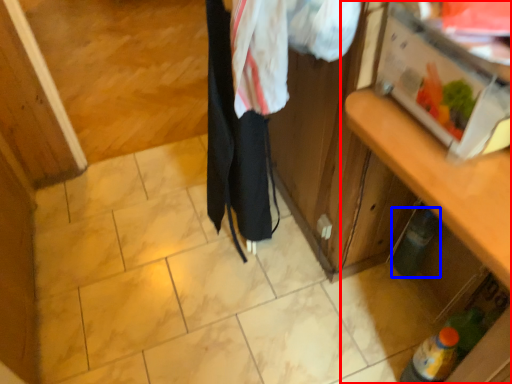
Question: Which object is closer to the camera taking this photo, cabinetry (highlighted by a red box) or bottle (highlighted by a blue box)?

Choices:
 (A) cabinetry
 (B) bottle

Answer: (A)